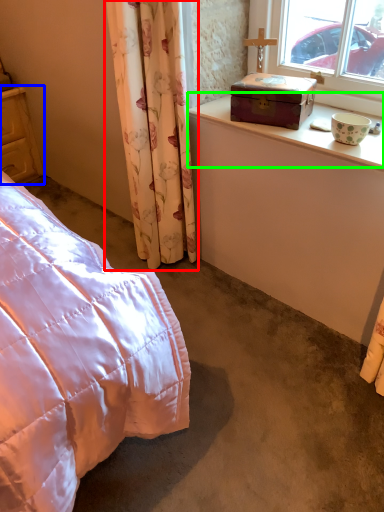
Question: Which object is the closest to the curtain (highlighted by a red box)? Choose among these: cupboard (highlighted by a blue box) or window sill (highlighted by a green box).

Choices:
 (A) cupboard
 (B) window sill

Answer: (B)